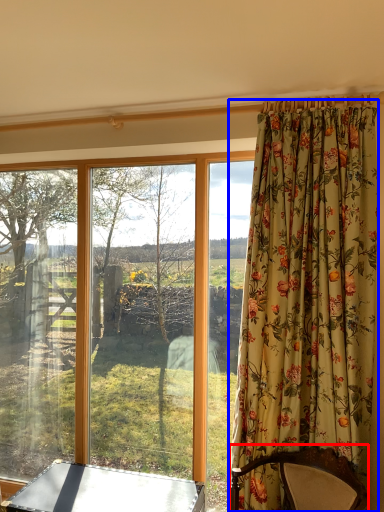
Question: Which object is closer to the camera taking this photo, furniture (highlighted by a red box) or curtain (highlighted by a blue box)?

Choices:
 (A) furniture
 (B) curtain

Answer: (A)